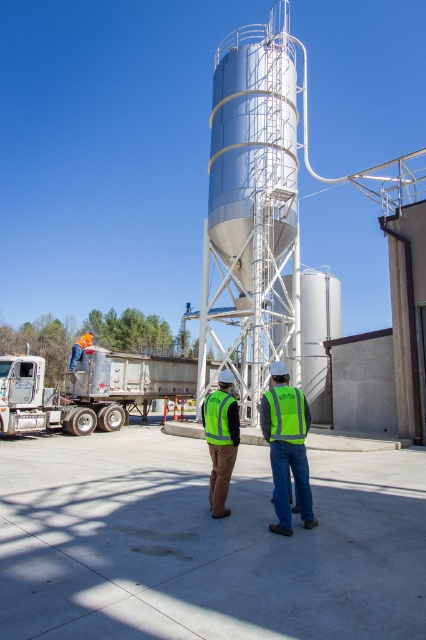
Is neon yellow vest at center positioned at the back of orange hard hat at lower left?

No, neon yellow vest at center is in front of orange hard hat at lower left.

Can you confirm if neon yellow vest at center is taller than orange hard hat at lower left?

Incorrect, neon yellow vest at center's height is not larger of orange hard hat at lower left's.

Is point (285, 512) less distant than point (81, 346)?

Yes.

This screenshot has width=426, height=640. Find the location of `neon yellow vest at center`. neon yellow vest at center is located at coordinates (287, 445).

Is neon yellow vest at center smaller than green reflective safety vest at lower right?

No, neon yellow vest at center is not smaller than green reflective safety vest at lower right.

Does neon yellow vest at center have a lesser height compared to green reflective safety vest at lower right?

No, neon yellow vest at center is not shorter than green reflective safety vest at lower right.

Which is in front, point (287, 524) or point (275, 422)?

Point (287, 524) is in front.

Locate an element on the screen. The image size is (426, 640). neon yellow vest at center is located at coordinates (287, 445).

Can you confirm if smooth metallic water tower at center is wider than green reflective vest at center?

Yes.

Can you confirm if smooth metallic water tower at center is positioned above green reflective vest at center?

Correct, smooth metallic water tower at center is located above green reflective vest at center.

Where is `smooth metallic water tower at center`? The image size is (426, 640). smooth metallic water tower at center is located at coordinates (253, 205).